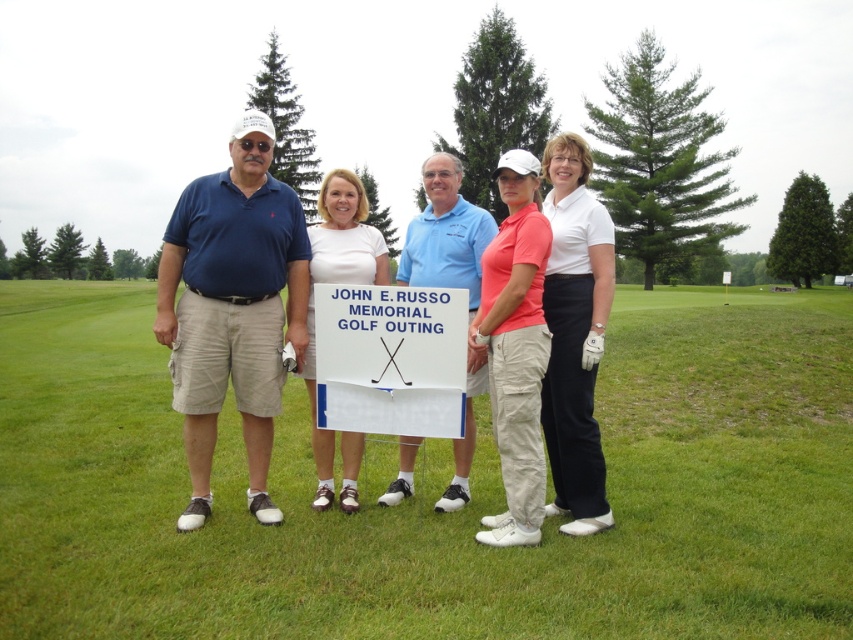
Question: Considering the real-world distances, which object is farthest from the matte coral shirt at center?

Choices:
 (A) blue cotton polo shirt at center
 (B) green grass at center

Answer: (B)

Question: Which point appears farthest from the camera in this image?

Choices:
 (A) (343, 218)
 (B) (514, 563)
 (C) (556, 154)

Answer: (A)

Question: Is white matte golf glove at center closer to camera compared to white matte signboard at center?

Choices:
 (A) yes
 (B) no

Answer: (A)

Question: Can you confirm if matte blue polo shirt at left is smaller than matte coral shirt at center?

Choices:
 (A) no
 (B) yes

Answer: (A)

Question: Which point is farther to the camera?

Choices:
 (A) matte coral shirt at center
 (B) white matte golf glove at center
 (C) matte blue polo shirt at left

Answer: (C)

Question: Considering the relative positions of white matte golf glove at center and matte coral shirt at center in the image provided, where is white matte golf glove at center located with respect to matte coral shirt at center?

Choices:
 (A) below
 (B) above

Answer: (B)